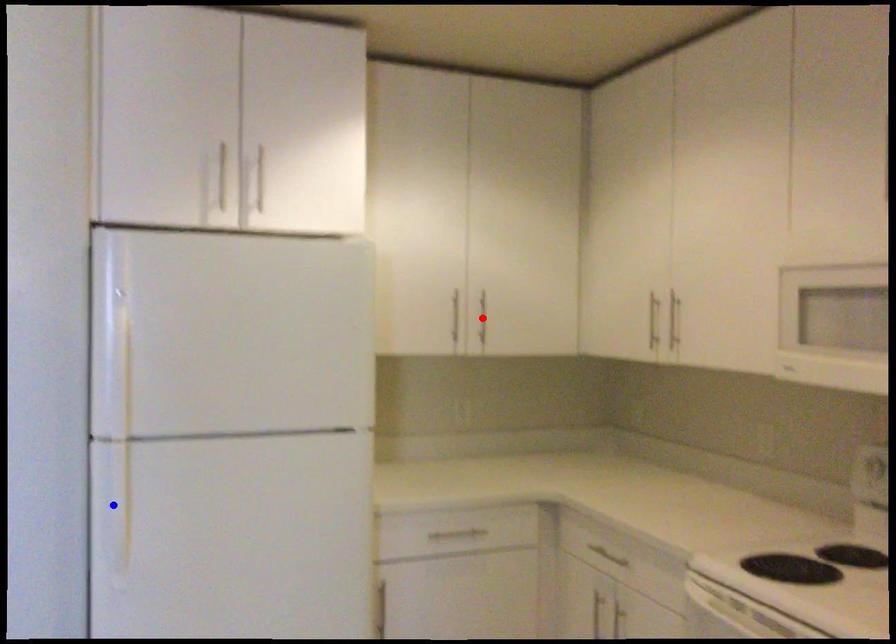
Question: Which of the two points in the image is closer to the camera?

Choices:
 (A) Blue point is closer.
 (B) Red point is closer.

Answer: (A)